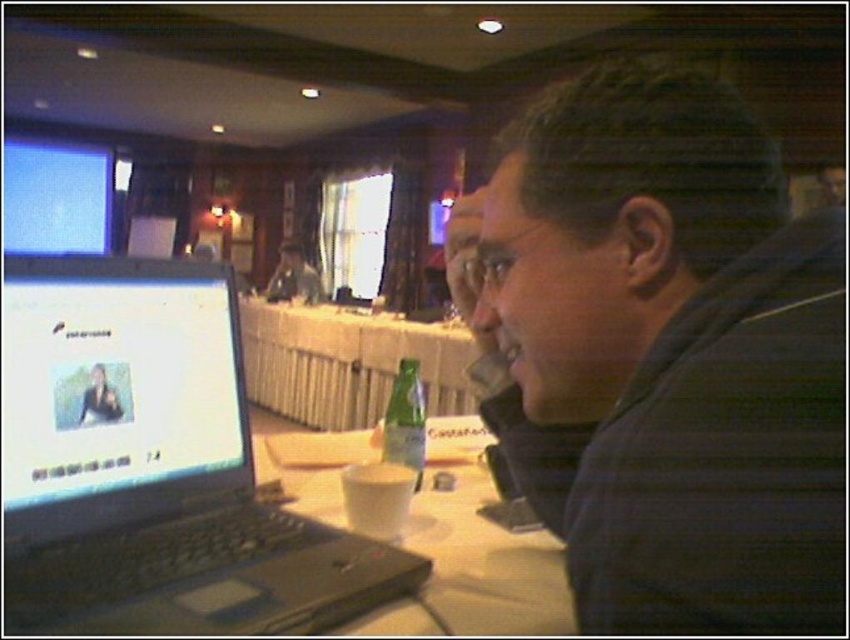
Is white paper at center positioned in front of matte screen at upper left?

Yes, it is in front of matte screen at upper left.

Is white paper at center further to the viewer compared to matte screen at upper left?

No.

Which is behind, point (446, 579) or point (58, 160)?

The point (58, 160) is behind.

I want to click on white paper at center, so click(486, 563).

Can you confirm if dark blue striped shirt at center is positioned below white paper at center?

Incorrect, dark blue striped shirt at center is not positioned below white paper at center.

The image size is (850, 640). What do you see at coordinates (667, 356) in the screenshot?
I see `dark blue striped shirt at center` at bounding box center [667, 356].

Where is `dark blue striped shirt at center`? This screenshot has height=640, width=850. dark blue striped shirt at center is located at coordinates (667, 356).

You are a GUI agent. You are given a task and a screenshot of the screen. Output one action in this format:
    pyautogui.click(x=<x>, y=<y>)
    Task: Click on the dark blue striped shirt at center
    This screenshot has height=640, width=850.
    Given the screenshot: What is the action you would take?
    pyautogui.click(x=667, y=356)

Find the location of `white wood table at center`. white wood table at center is located at coordinates pyautogui.click(x=346, y=364).

Which of these two, white wood table at center or matte black laptop at center, stands shorter?

Standing shorter between the two is matte black laptop at center.

Which is behind, point (338, 381) or point (268, 298)?

The point (268, 298) is more distant.

You are a GUI agent. You are given a task and a screenshot of the screen. Output one action in this format:
    pyautogui.click(x=<x>, y=<y>)
    Task: Click on the white wood table at center
    This screenshot has height=640, width=850.
    Given the screenshot: What is the action you would take?
    pyautogui.click(x=346, y=364)